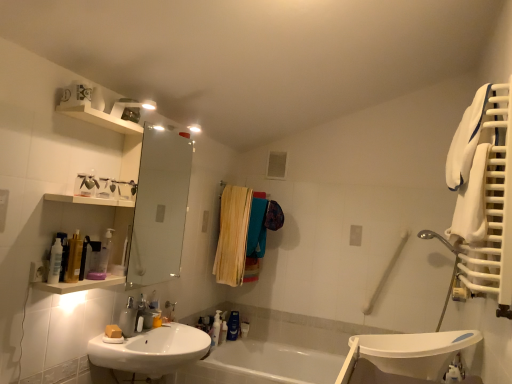
You are a GUI agent. You are given a task and a screenshot of the screen. Output one action in this format:
    pyautogui.click(x=<x>, y=<y>)
    Task: Click on the free space in front of metallic silver faucet at sink left
    The width and height of the screenshot is (512, 384).
    Given the screenshot: What is the action you would take?
    pyautogui.click(x=149, y=337)